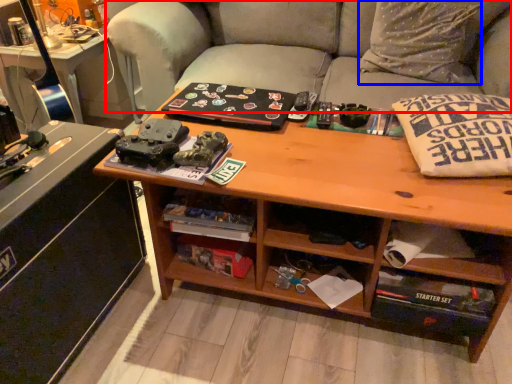
Question: Which object appears closest to the camera in this image, studio couch (highlighted by a red box) or throw pillow (highlighted by a blue box)?

Choices:
 (A) studio couch
 (B) throw pillow

Answer: (A)